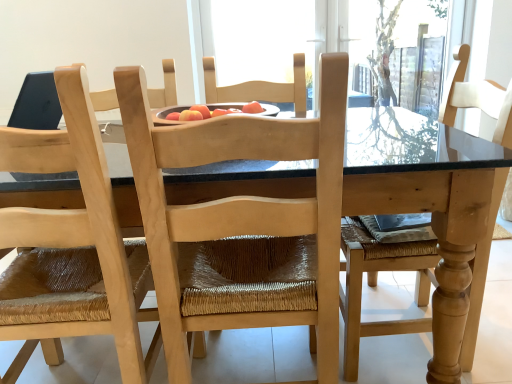
Question: In which direction should I rotate to look at natural wood chair at center, which is the 1th chair in left-to-right order?

Choices:
 (A) right
 (B) left

Answer: (B)

Question: Should I look upward or downward to see natural wood table at center?

Choices:
 (A) up
 (B) down

Answer: (B)

Question: Would you say natural wood chair at center, which is the 1th chair in left-to-right order, contains natural wood table at center?

Choices:
 (A) no
 (B) yes

Answer: (A)

Question: Can you confirm if natural wood chair at center, the second chair in the right-to-left sequence, is bigger than natural wood table at center?

Choices:
 (A) no
 (B) yes

Answer: (A)

Question: Can you confirm if natural wood chair at center, which is the 1th chair in left-to-right order, is thinner than natural wood table at center?

Choices:
 (A) yes
 (B) no

Answer: (A)

Question: Does natural wood chair at center, the second chair in the right-to-left sequence, have a greater height compared to natural wood table at center?

Choices:
 (A) yes
 (B) no

Answer: (A)

Question: Is natural wood chair at center, which is the 1th chair in left-to-right order, beside natural wood table at center?

Choices:
 (A) no
 (B) yes

Answer: (A)

Question: Is natural wood chair at center, the second chair in the right-to-left sequence, shorter than natural wood table at center?

Choices:
 (A) no
 (B) yes

Answer: (A)

Question: Considering the relative positions of natural wood chair at center, which appears as the second chair when viewed from the left, and natural wood chair at center, the second chair in the right-to-left sequence, in the image provided, is natural wood chair at center, which appears as the second chair when viewed from the left, in front of natural wood chair at center, the second chair in the right-to-left sequence,?

Choices:
 (A) no
 (B) yes

Answer: (A)

Question: From a real-world perspective, is natural wood chair at center, the first chair when ordered from right to left, located higher than natural wood chair at center, the second chair in the right-to-left sequence?

Choices:
 (A) yes
 (B) no

Answer: (A)

Question: Considering the relative sizes of natural wood chair at center, which appears as the second chair when viewed from the left, and natural wood chair at center, the second chair in the right-to-left sequence, in the image provided, is natural wood chair at center, which appears as the second chair when viewed from the left, taller than natural wood chair at center, the second chair in the right-to-left sequence,?

Choices:
 (A) no
 (B) yes

Answer: (A)

Question: Is natural wood chair at center, which appears as the second chair when viewed from the left, oriented away from natural wood chair at center, the second chair in the right-to-left sequence?

Choices:
 (A) no
 (B) yes

Answer: (A)

Question: Could you tell me if natural wood chair at center, the first chair when ordered from right to left, is facing natural wood chair at center, the second chair in the right-to-left sequence?

Choices:
 (A) no
 (B) yes

Answer: (A)

Question: From the image's perspective, does natural wood chair at center, the first chair when ordered from right to left, appear higher than natural wood chair at center, which is the 1th chair in left-to-right order?

Choices:
 (A) no
 (B) yes

Answer: (B)

Question: From the image's perspective, is natural wood chair at center, the first chair when ordered from right to left, above natural wood table at center?

Choices:
 (A) yes
 (B) no

Answer: (A)